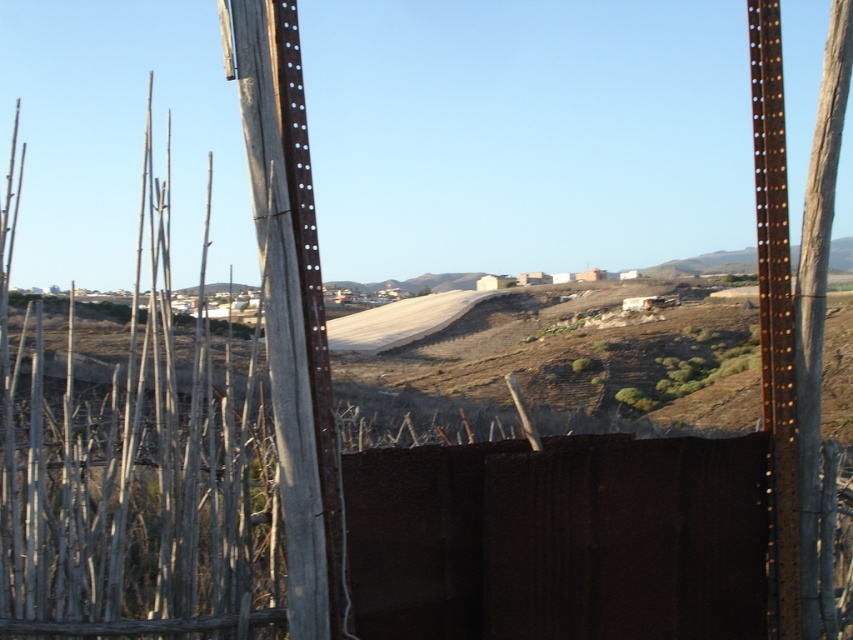
Who is higher up, rusty metal fence at center or rusty metal pole at right?

rusty metal pole at right

Which is behind, point (395, 531) or point (782, 451)?

The point (782, 451) is behind.

Find the location of a particular element. This screenshot has width=853, height=640. rusty metal fence at center is located at coordinates (560, 538).

Does point (341, 536) come behind point (798, 529)?

No, it is in front of (798, 529).

What are the coordinates of `rusty metal pole at center` in the screenshot? It's located at (291, 307).

Is rusty metal fence at center thinner than rusty metal pole at center?

Incorrect, rusty metal fence at center's width is not less than rusty metal pole at center's.

Is point (647, 582) positioned after point (329, 516)?

Yes, point (647, 582) is behind point (329, 516).

The image size is (853, 640). I want to click on rusty metal fence at center, so click(560, 538).